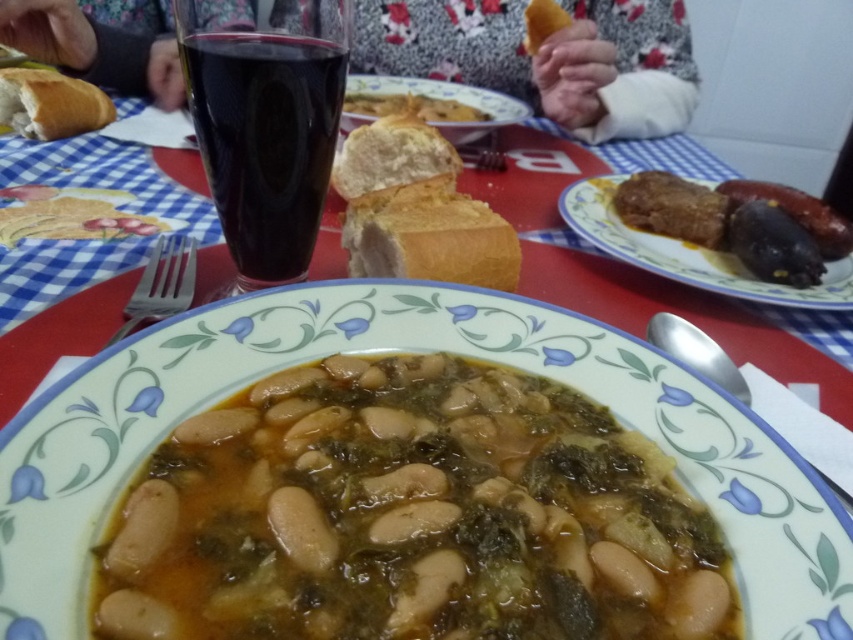
Question: Which point appears closest to the camera in this image?

Choices:
 (A) (723, 385)
 (B) (607, 483)
 (C) (155, 65)

Answer: (B)

Question: Based on their relative distances, which object is nearer to the floral-patterned sweater at upper center?

Choices:
 (A) white matte bread at upper center
 (B) dark glass at upper center

Answer: (A)

Question: Among these points, which one is nearest to the camera?

Choices:
 (A) (520, 113)
 (B) (590, 209)

Answer: (B)

Question: Where is dark glass at upper center located in relation to brown crispy meat at right in the image?

Choices:
 (A) right
 (B) left

Answer: (B)

Question: Can you confirm if dark glass at upper center is positioned to the right of golden crispy bread at upper center?

Choices:
 (A) no
 (B) yes

Answer: (A)

Question: Can you confirm if brown crispy meat at right is bigger than white matte bread at upper center?

Choices:
 (A) no
 (B) yes

Answer: (A)